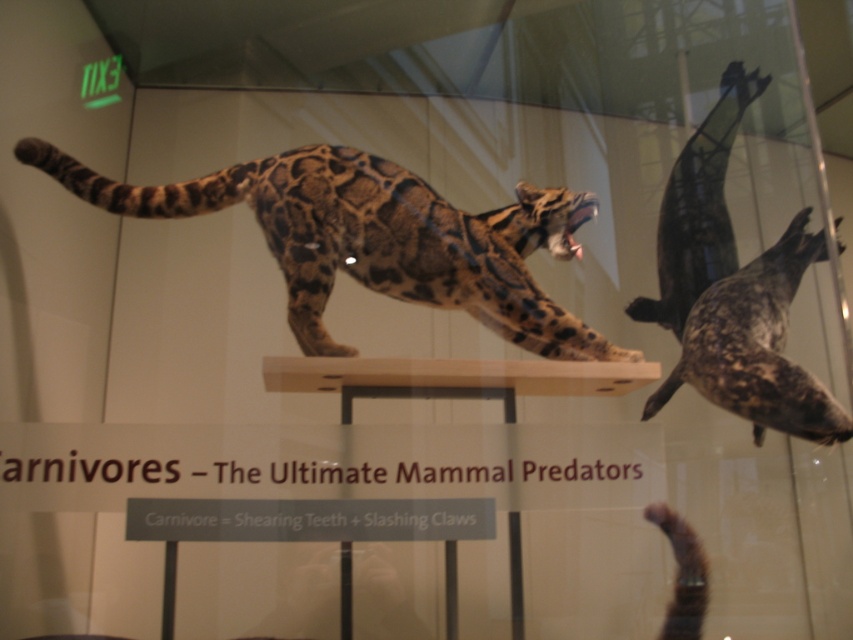
Who is higher up, spotted fur jaguar at center or dark brown fur seal at right?

dark brown fur seal at right

Between spotted fur jaguar at center and dark brown fur seal at right, which one has less height?

spotted fur jaguar at center is shorter.

Who is more distant from viewer, [503,310] or [656,253]?

Point [656,253]

Identify the location of spotted fur jaguar at center. (375, 237).

Does spotted fur jaguar at center have a smaller size compared to speckled fur seal at right?

Yes.

Is point (352, 248) farther from viewer compared to point (764, 358)?

No, (352, 248) is in front of (764, 358).

The width and height of the screenshot is (853, 640). I want to click on spotted fur jaguar at center, so click(375, 237).

Can you confirm if speckled fur seal at right is bigger than dark brown fur seal at right?

Yes, speckled fur seal at right is bigger than dark brown fur seal at right.

Can you confirm if speckled fur seal at right is positioned to the left of dark brown fur seal at right?

Yes, speckled fur seal at right is to the left of dark brown fur seal at right.

What are the coordinates of `speckled fur seal at right` in the screenshot? It's located at click(757, 346).

This screenshot has width=853, height=640. Identify the location of speckled fur seal at right. (757, 346).